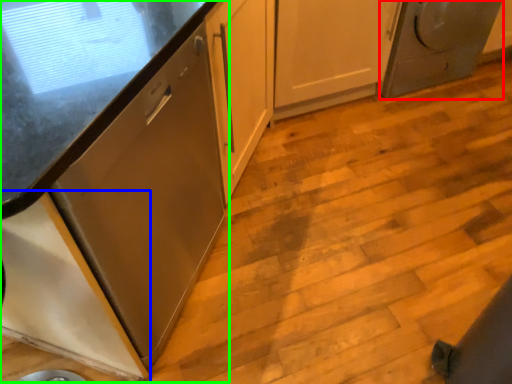
Question: Which object is positioned closest to home appliance (highlighted by a red box)? Select from cabinetry (highlighted by a blue box) and cabinetry (highlighted by a green box).

Choices:
 (A) cabinetry
 (B) cabinetry

Answer: (B)